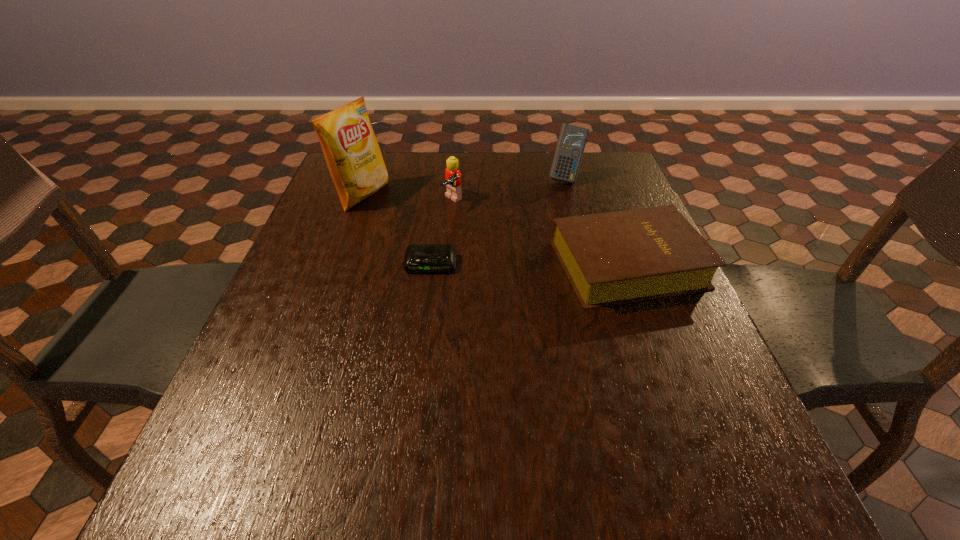
Locate an element on the screen. The height and width of the screenshot is (540, 960). free spot on the desktop that is between the shortest object and the Bible and is positioned on the front-facing side of the leftmost object is located at coordinates (538, 264).

Locate an element on the screen. Image resolution: width=960 pixels, height=540 pixels. vacant space on the desktop that is between the shortest object and the Bible and is positioned on the front-facing side of the calculator is located at coordinates (554, 264).

In order to click on vacant space on the desktop that is between the shortest object and the fourth tallest object and is positioned in front of the Lego with the accessory visible in this screenshot , I will do `click(553, 264)`.